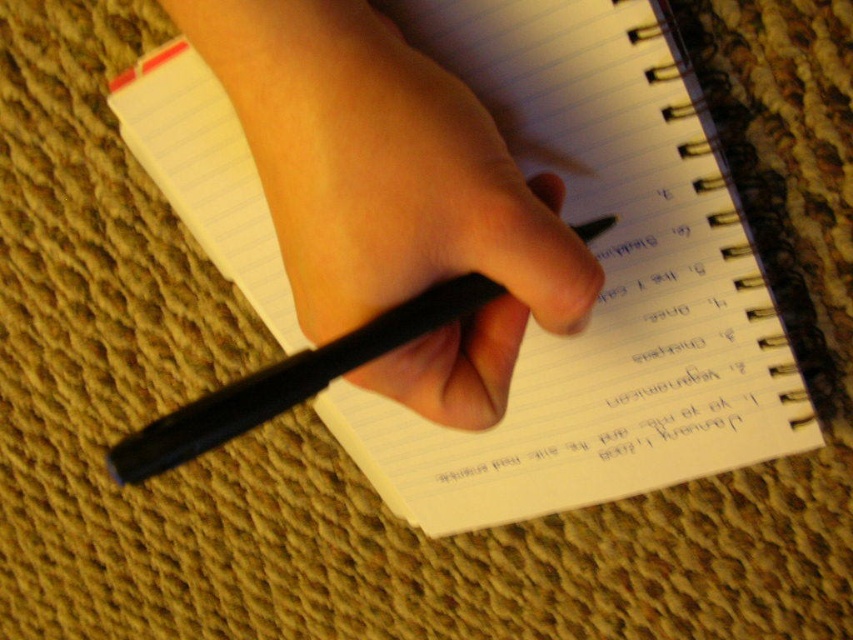
Does white paper notebook at center have a lesser width compared to black matte pen at center?

In fact, white paper notebook at center might be wider than black matte pen at center.

Does white paper notebook at center appear over black matte pen at center?

Actually, white paper notebook at center is below black matte pen at center.

Image resolution: width=853 pixels, height=640 pixels. I want to click on white paper notebook at center, so click(x=604, y=284).

This screenshot has height=640, width=853. I want to click on white paper notebook at center, so click(x=604, y=284).

Is black matte pen at center closer to camera compared to black matte pencil at center?

That is True.

Does point (322, 93) come in front of point (146, 445)?

Yes.

I want to click on black matte pen at center, so click(x=392, y=195).

The width and height of the screenshot is (853, 640). I want to click on white paper notebook at center, so (x=604, y=284).

I want to click on white paper notebook at center, so click(x=604, y=284).